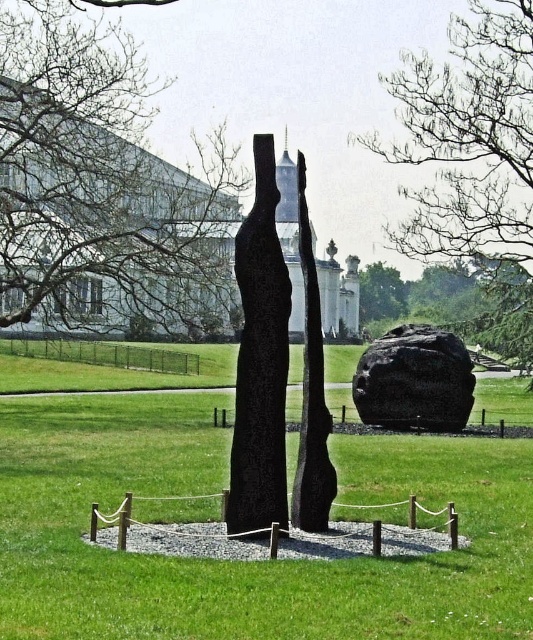
You are a landscape architect designing a garden path. You want to place a 1.5 meter wide walkway between the green grass at center and the smooth bark tree at center. Based on their widths, will the walkway fit between them?

The green grass at center is wider than the smooth bark tree at center. Since the walkway is 1.5 meters wide, it depends on the actual widths. However, the description only states that the grass is wider, not by how much. Without specific measurements, we cannot confirm if the walkway will fit.

You are an art student visiting the sculpture garden and want to sketch the black polished stone at center and the polished dark stone sculpture at center. Since you can only focus on one object at a time, which one should you sketch first if you want to capture the one that is positioned to the left?

The black polished stone at center is to the left of the polished dark stone sculpture at center, so you should sketch the black polished stone at center first as it is positioned to the left.